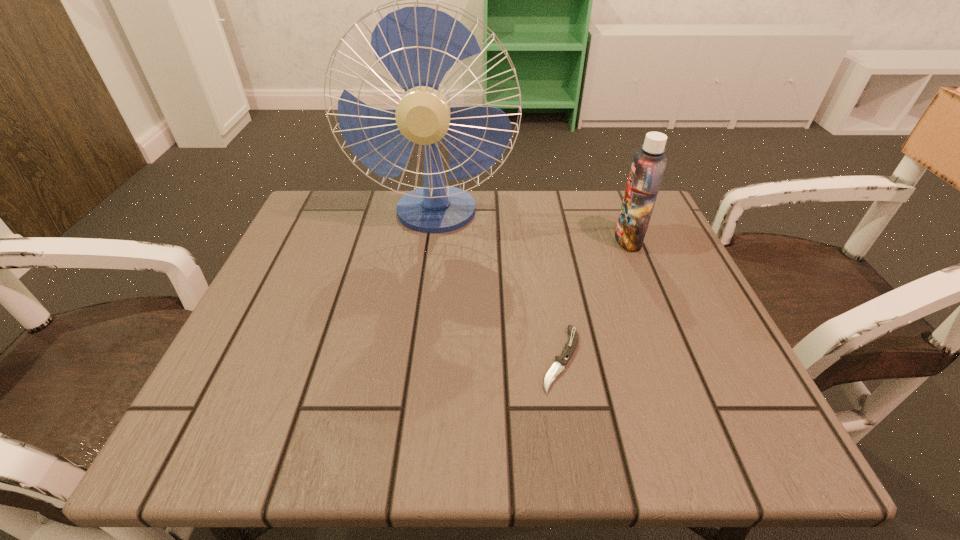
Locate an element on the screen. Image resolution: width=960 pixels, height=540 pixels. vacant region between the tallest object and the shortest object is located at coordinates (498, 286).

Where is `free space between the tallest object and the second tallest object`? This screenshot has width=960, height=540. free space between the tallest object and the second tallest object is located at coordinates (532, 227).

You are a GUI agent. You are given a task and a screenshot of the screen. Output one action in this format:
    pyautogui.click(x=<x>, y=<y>)
    Task: Click on the unoccupied position between the nearest object and the shampoo
    
    Given the screenshot: What is the action you would take?
    pyautogui.click(x=595, y=299)

Identify which object is the second nearest to the shampoo. Please provide its 2D coordinates. Your answer should be formatted as a tuple, i.e. [(x, y)], where the tuple contains the x and y coordinates of a point satisfying the conditions above.

[(561, 361)]

Point out which object is positioned as the second nearest to the fan. Please provide its 2D coordinates. Your answer should be formatted as a tuple, i.e. [(x, y)], where the tuple contains the x and y coordinates of a point satisfying the conditions above.

[(561, 361)]

The image size is (960, 540). I want to click on vacant region that satisfies the following two spatial constraints: 1. at the front of the leftmost object where the blades are visible; 2. on the left side of the second object from right to left, so click(417, 359).